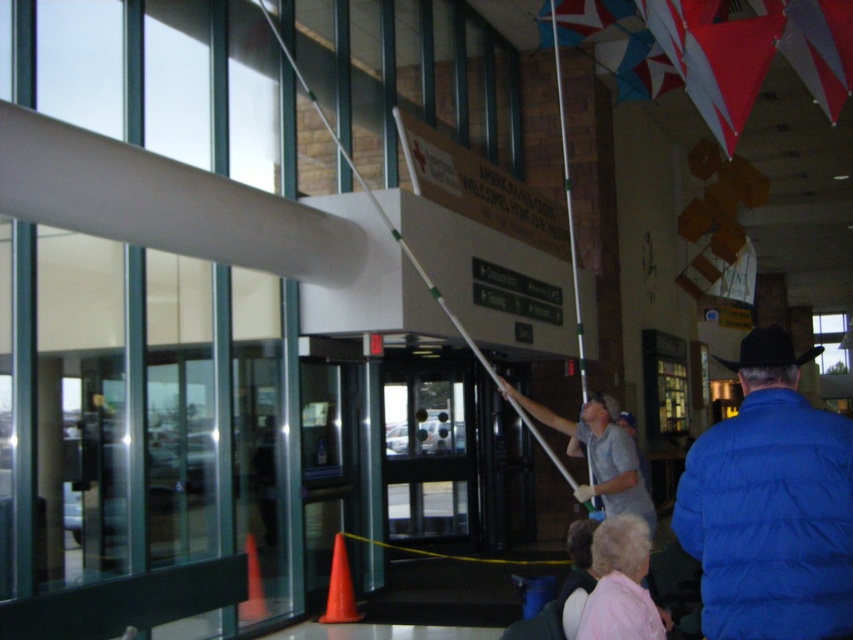
Question: Which of the following is the farthest from the observer?

Choices:
 (A) (637, 636)
 (B) (653, 509)
 (C) (811, 499)

Answer: (B)

Question: Which object is closer to the camera taking this photo?

Choices:
 (A) blue puffy jacket at center
 (B) yellow string at center
 (C) orange plastic cone at lower left

Answer: (A)

Question: Which object is the closest to the blue puffy jacket at center?

Choices:
 (A) yellow string at center
 (B) orange matte cone at lower left
 (C) gray fabric pole at center
 (D) orange plastic cone at lower left

Answer: (C)

Question: Is pink fabric at lower right thinner than orange matte cone at lower left?

Choices:
 (A) no
 (B) yes

Answer: (B)

Question: Can you confirm if blue puffy jacket at center is positioned to the left of orange matte cone at lower left?

Choices:
 (A) yes
 (B) no

Answer: (B)

Question: Is yellow string at center bigger than orange plastic cone at lower left?

Choices:
 (A) no
 (B) yes

Answer: (B)